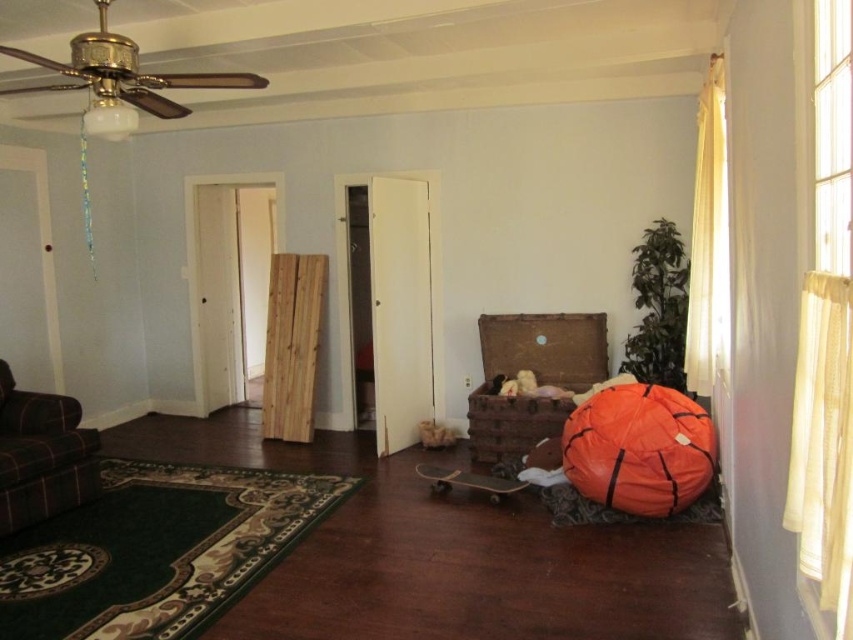
Who is positioned more to the right, rustic wooden trunk at center or plaid fabric couch at lower left?

rustic wooden trunk at center is more to the right.

What do you see at coordinates (535, 378) in the screenshot? I see `rustic wooden trunk at center` at bounding box center [535, 378].

Find the location of a particular element. This screenshot has width=853, height=640. rustic wooden trunk at center is located at coordinates (535, 378).

Can you confirm if orange fabric sleeping bag at lower right is positioned to the right of plaid fabric couch at lower left?

Indeed, orange fabric sleeping bag at lower right is positioned on the right side of plaid fabric couch at lower left.

Can you confirm if orange fabric sleeping bag at lower right is shorter than plaid fabric couch at lower left?

Yes.

Find the location of a particular element. orange fabric sleeping bag at lower right is located at coordinates (639, 449).

The height and width of the screenshot is (640, 853). Identify the location of orange fabric sleeping bag at lower right. (639, 449).

Looking at this image, is orange fabric sleeping bag at lower right below rustic wooden trunk at center?

Yes, orange fabric sleeping bag at lower right is below rustic wooden trunk at center.

Which is more to the right, orange fabric sleeping bag at lower right or rustic wooden trunk at center?

orange fabric sleeping bag at lower right

Which is behind, point (715, 445) or point (519, 340)?

Point (519, 340)

Find the location of a particular element. orange fabric sleeping bag at lower right is located at coordinates (639, 449).